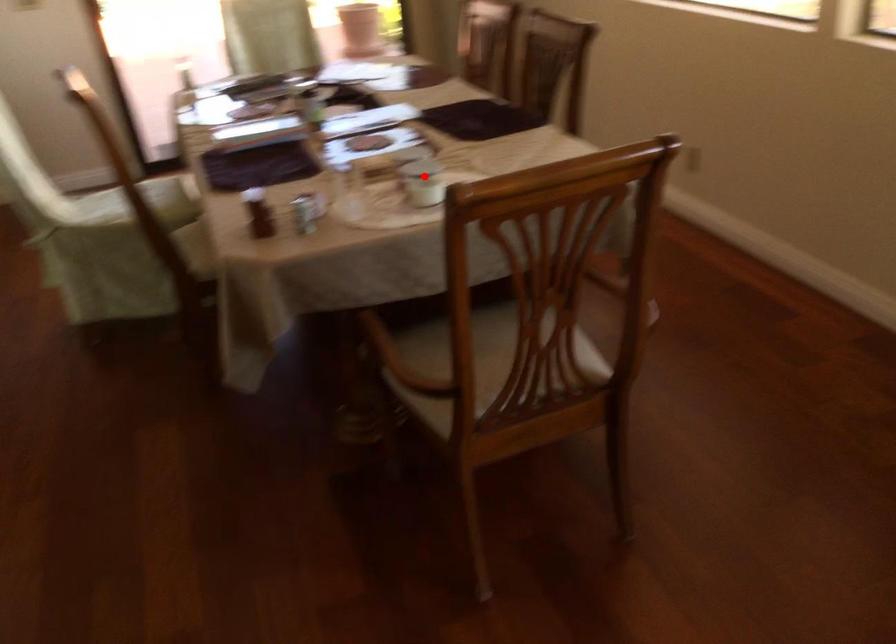
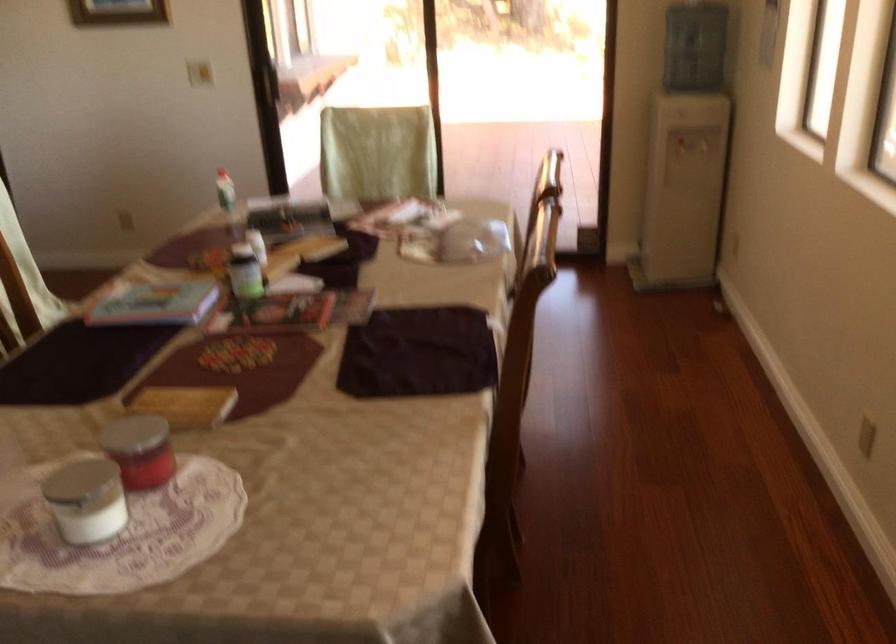
The point at the highlighted location is marked in the first image. Where is the corresponding point in the second image?

(85, 500)